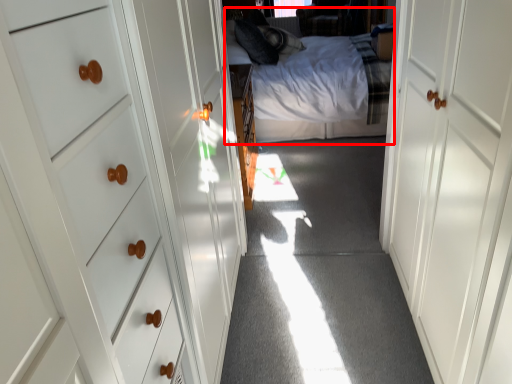
Question: From the image's perspective, what is the correct spatial positioning of bed (annotated by the red box) in reference to door?

Choices:
 (A) above
 (B) below

Answer: (A)